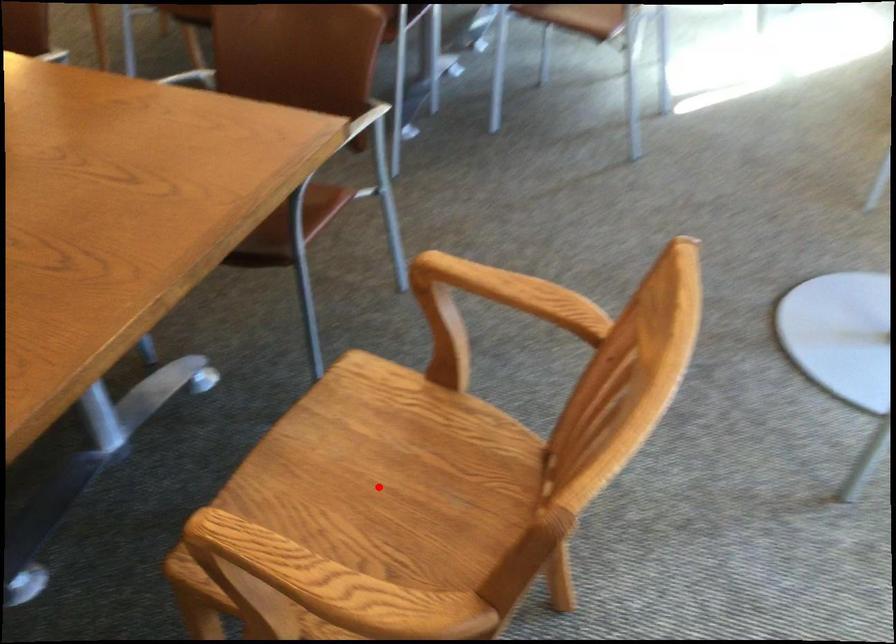
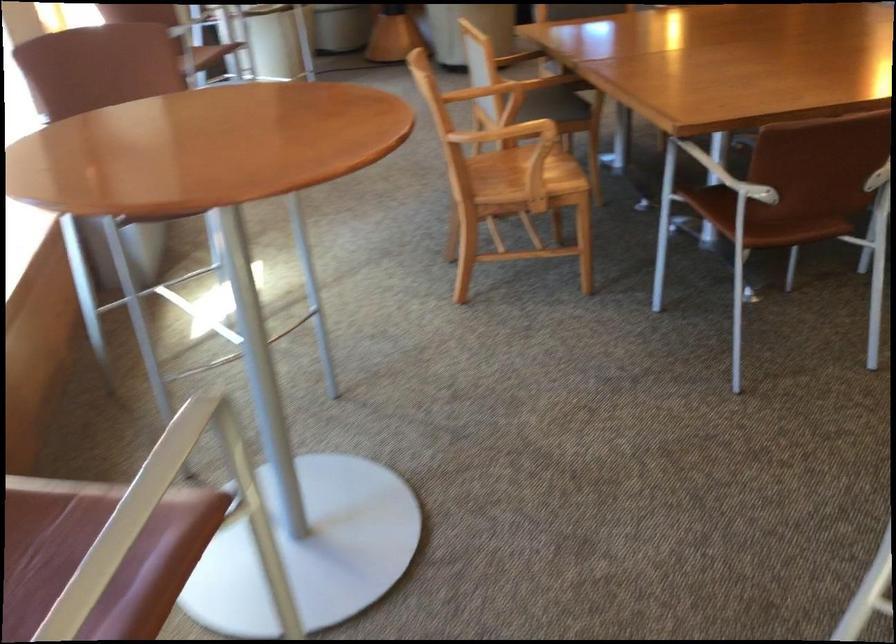
Question: I am providing you with two images of the same scene from different viewpoints. A red point is marked on the first image. Can you still see the location of the red point in image 2?

Choices:
 (A) Yes
 (B) No

Answer: (B)